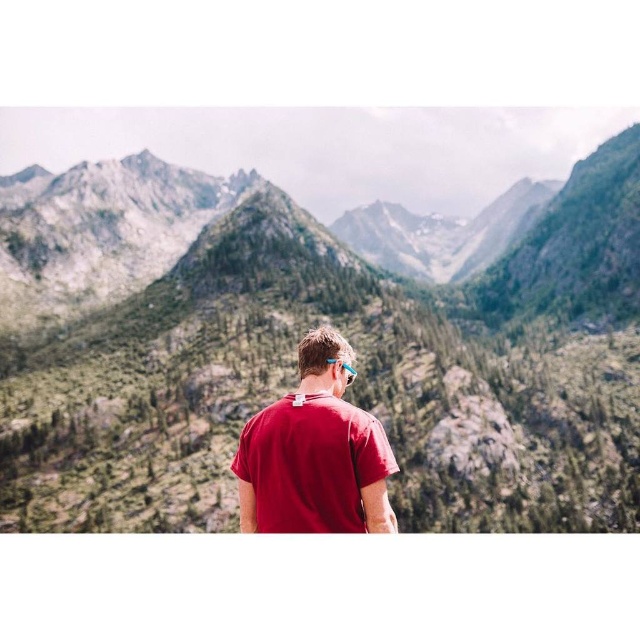
You are standing at the point closer to the camera between point (520,321) and point (349,465). Which point are you at?

You are at point (520,321) because it is further to the camera than point (349,465).

You are a hiker who wants to reach the highest point of the green textured mountains at center. Based on the coordinates provided, which direction should you head from your current position?

The highest point of the green textured mountains at center is located at coordinates point (339, 328). Since the question doesn

You are a hiker who wants to take a photo of the green textured mountains at center and the blue rubber goggles at center. Which object should you focus on first if you want both to be in clear focus?

The green textured mountains at center should be focused on first because they are taller than the blue rubber goggles at center, so focusing on the farther object first will ensure both are in focus.